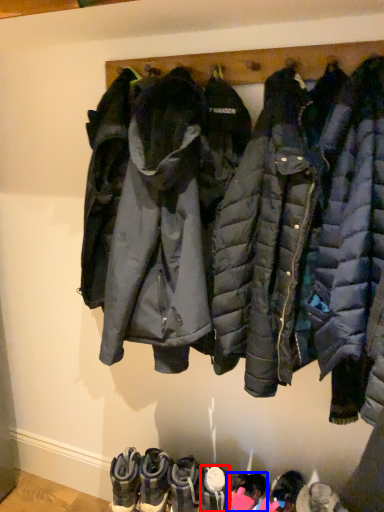
Question: Which of the following is the closest to the observer, footwear (highlighted by a red box) or footwear (highlighted by a blue box)?

Choices:
 (A) footwear
 (B) footwear

Answer: (B)